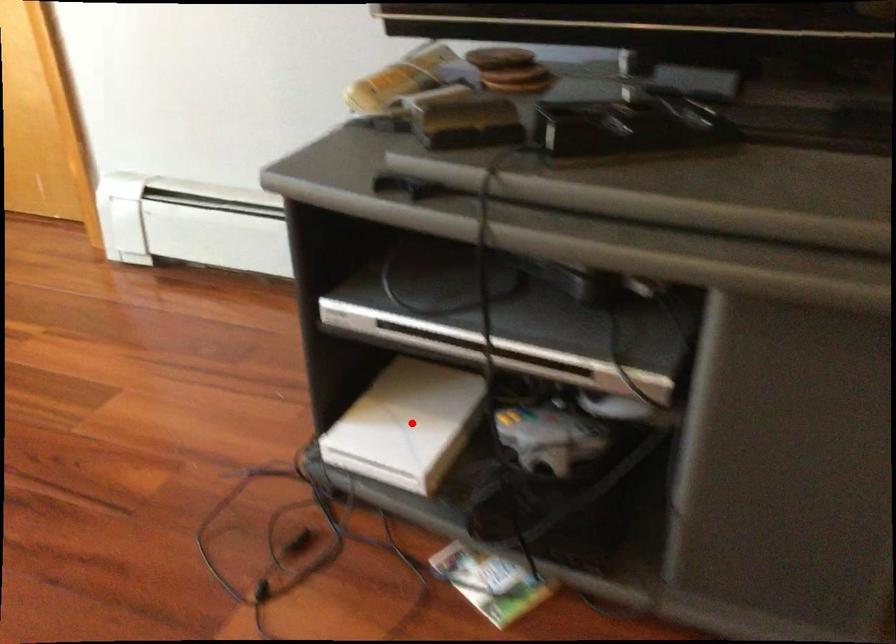
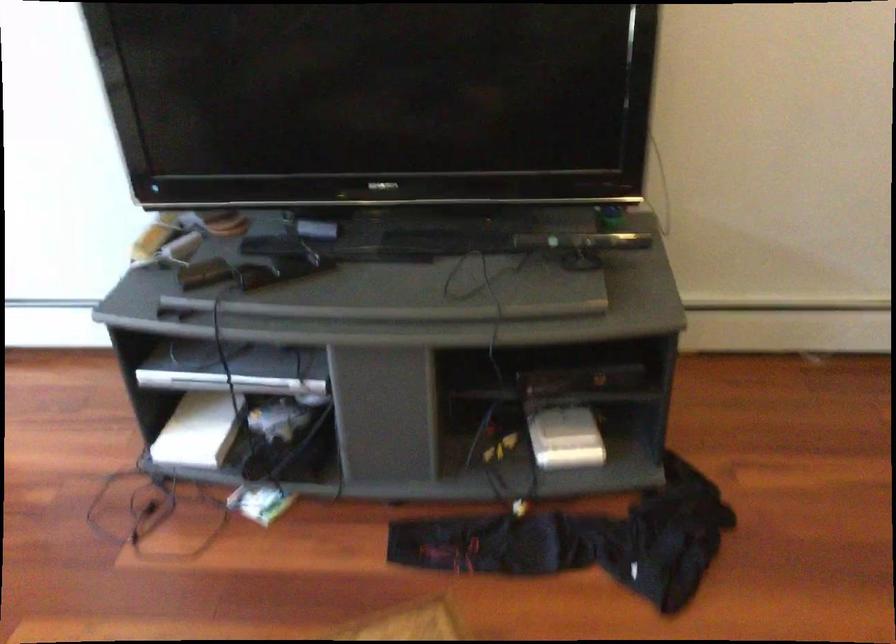
Question: I am providing you with two images of the same scene from different viewpoints. A red point is shown in image1. For the corresponding object point in image2, is it positioned nearer or farther from the camera?

Choices:
 (A) Nearer
 (B) Farther

Answer: (B)